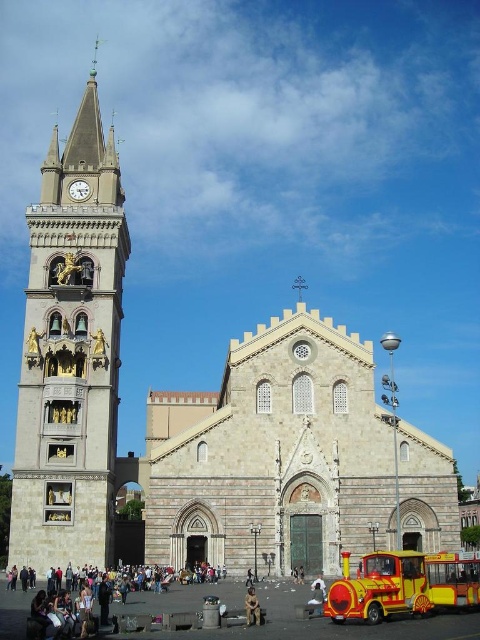
Which is behind, point (207, 451) or point (414, 552)?

The point (207, 451) is behind.

Which is in front, point (219, 474) or point (356, 580)?

Point (356, 580) is in front.

Which is in front, point (315, 422) or point (395, 604)?

Point (395, 604) is in front.

Locate an element on the screen. The height and width of the screenshot is (640, 480). light beige stone church at center is located at coordinates (290, 460).

Between yellow painted metal tour bus at lower right and camouflage fabric person at lower center, which one is positioned lower?

camouflage fabric person at lower center is lower down.

Does point (450, 604) come behind point (255, 602)?

Yes.

Image resolution: width=480 pixels, height=640 pixels. What are the coordinates of `yellow painted metal tour bus at lower right` in the screenshot? It's located at (403, 584).

Does light beige stone church at center appear on the right side of white marble clock at upper left?

Correct, you'll find light beige stone church at center to the right of white marble clock at upper left.

Based on the photo, measure the distance between light beige stone church at center and camera.

The distance of light beige stone church at center from camera is 208.72 feet.

Does point (377, 509) come in front of point (72, 182)?

Yes, it is in front of point (72, 182).

This screenshot has width=480, height=640. I want to click on light beige stone church at center, so click(x=290, y=460).